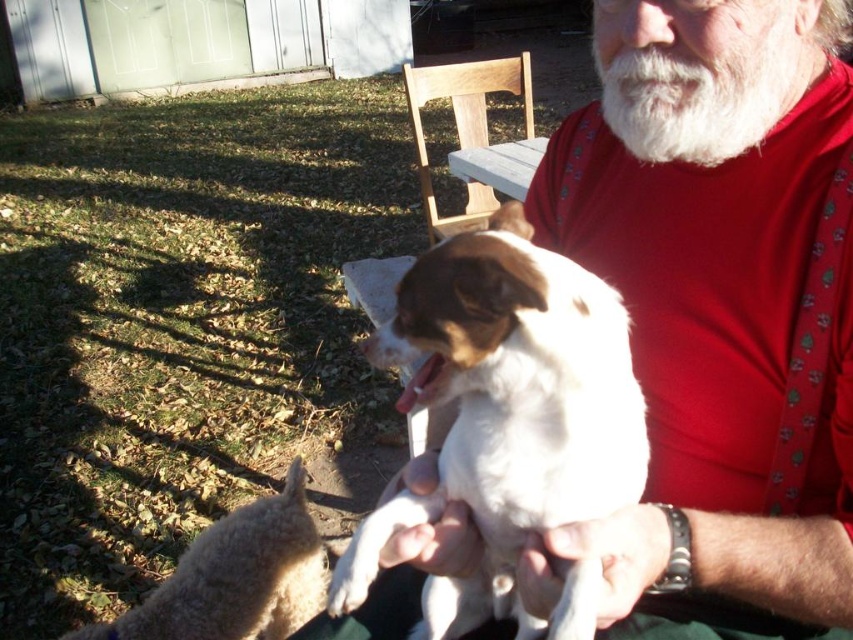
Is point (763, 230) closer to viewer compared to point (720, 100)?

No, it is not.

Which is in front, point (399, 480) or point (749, 134)?

Positioned in front is point (399, 480).

What are the coordinates of `smooth red shirt at center` in the screenshot? It's located at (718, 307).

At what (x,y) coordinates should I click in order to perform the action: click on smooth red shirt at center. Please return your answer as a coordinate pair (x, y). Image resolution: width=853 pixels, height=640 pixels. Looking at the image, I should click on (718, 307).

Which of these two, white fluffy dog at center or white fluffy beard at upper center, stands shorter?

white fluffy beard at upper center is shorter.

Who is lower down, white fluffy dog at center or white fluffy beard at upper center?

white fluffy dog at center is lower down.

Is point (523, 458) positioned before point (747, 109)?

That is True.

Find the location of a particular element. This screenshot has height=640, width=853. white fluffy dog at center is located at coordinates (508, 420).

The image size is (853, 640). Find the location of `smooth red shirt at center`. smooth red shirt at center is located at coordinates (718, 307).

Is point (738, 502) closer to viewer compared to point (281, 556)?

That is True.

The height and width of the screenshot is (640, 853). Identify the location of smooth red shirt at center. [x=718, y=307].